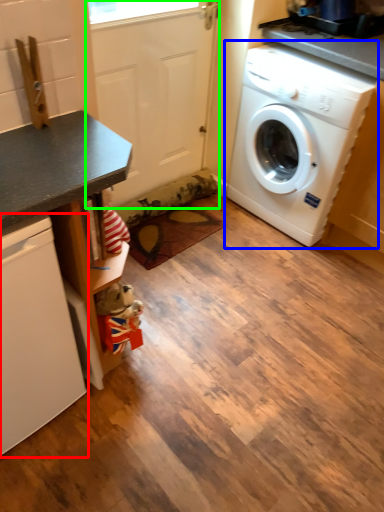
Question: Based on their relative distances, which object is nearer to dish washer (highlighted by a red box)? Choose from washing machine (highlighted by a blue box) and screen door (highlighted by a green box).

Choices:
 (A) washing machine
 (B) screen door

Answer: (B)